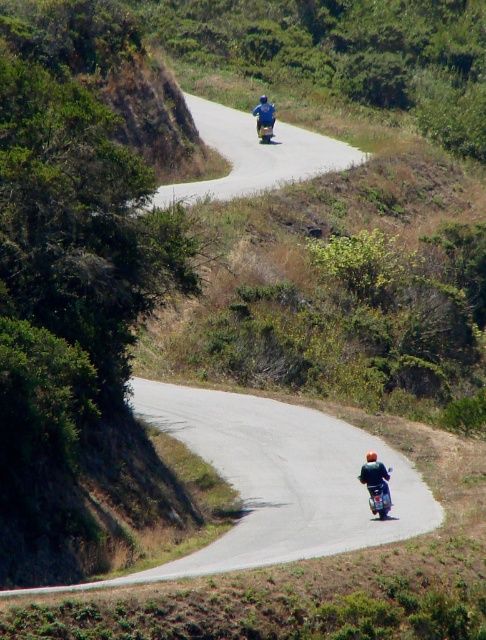
You are a photographer standing at the edge of the smooth asphalt road at center. You want to take a photo of the blue metallic motorcycle at upper center so that it appears larger in the frame. What should you do to achieve this?

To make the blue metallic motorcycle at upper center appear larger in the photo, move closer to it while staying on the smooth asphalt road at center since objects appear larger when they are nearer to the camera.

You are a photographer standing at the starting point of the road. You want to take a photo that includes both the dark blue jacket at lower right and the blue metallic motorcycle at upper center. Which object will appear smaller in the photo?

The dark blue jacket at lower right will appear smaller in the photo because it has a lesser height compared to the blue metallic motorcycle at upper center.

Based on the photo, you are standing at the starting point of the road and want to reach the dark blue jacket at lower right located at point (375, 474). Which direction should you head to reach it?

The dark blue jacket at lower right is located at point (375, 474), so you should head towards the lower right direction to reach it.